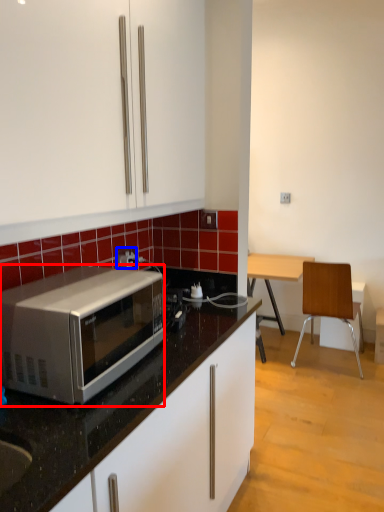
Question: Which point is closer to the camera, microwave oven (highlighted by a red box) or power outlet (highlighted by a blue box)?

Choices:
 (A) microwave oven
 (B) power outlet

Answer: (A)